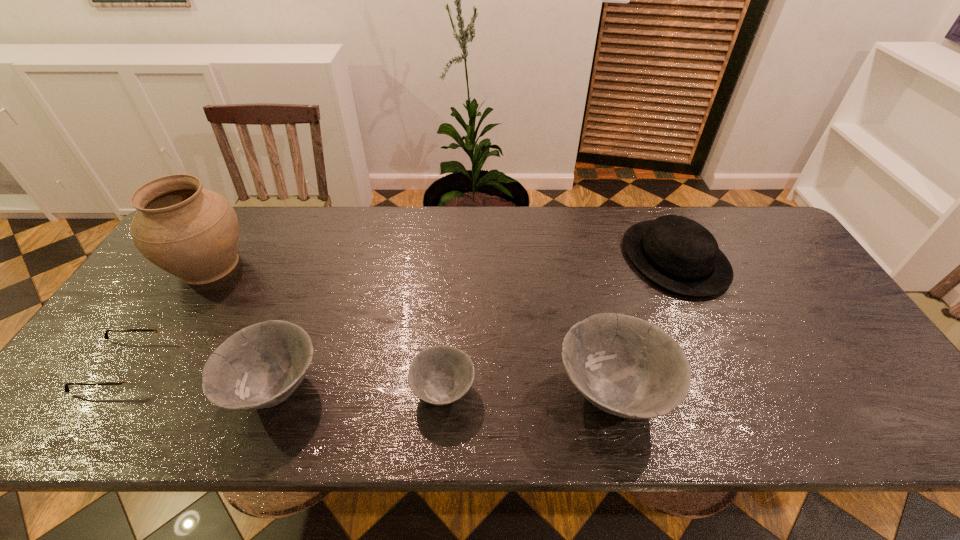
Please show where to add a bowl on the right while keeping spacing even. Please provide its 2D coordinates. Your answer should be formatted as a tuple, i.e. [(x, y)], where the tuple contains the x and y coordinates of a point satisfying the conditions above.

[(782, 394)]